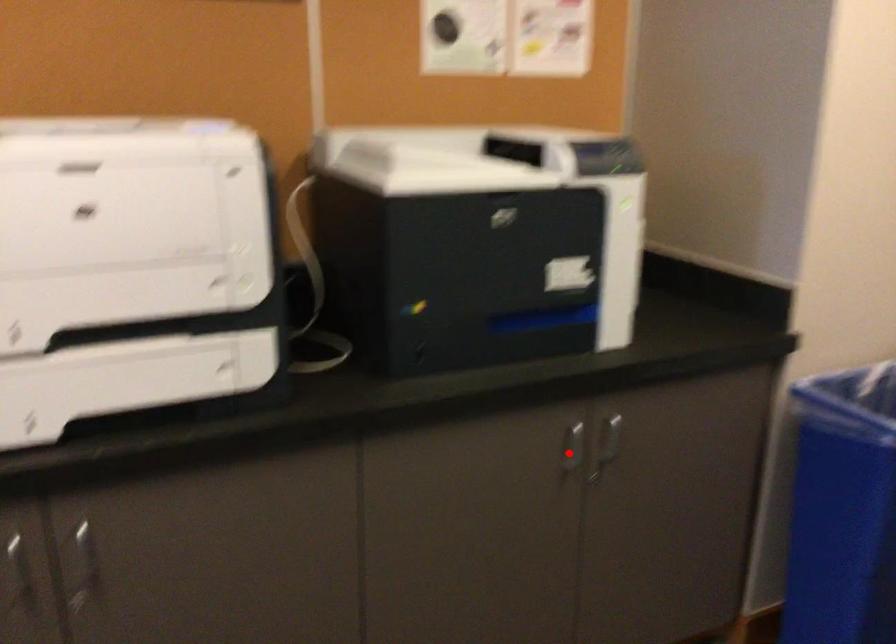
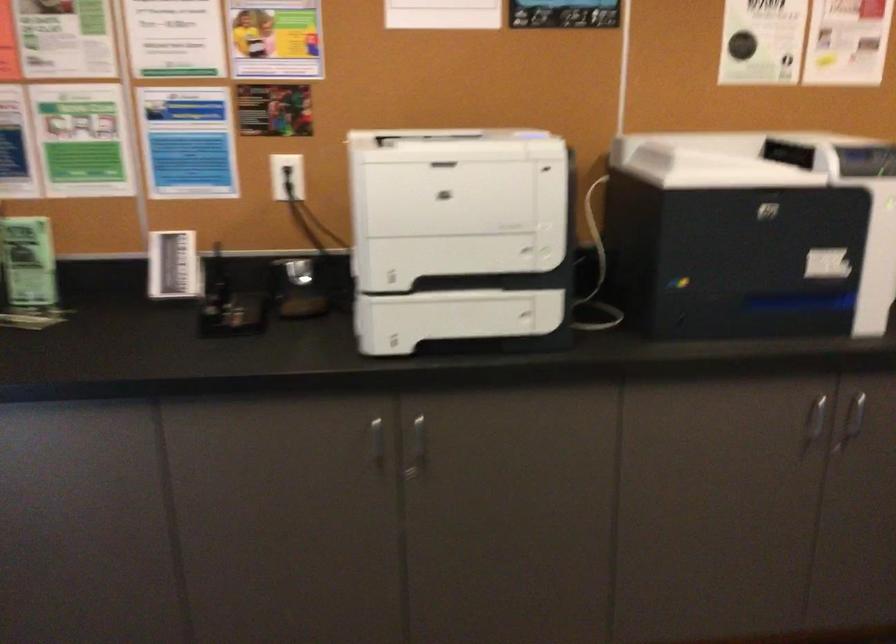
Question: I am providing you with two images of the same scene from different viewpoints. Given a red point in image1, look at the same physical point in image2. Is it:

Choices:
 (A) Closer to the viewpoint
 (B) Farther from the viewpoint

Answer: (B)